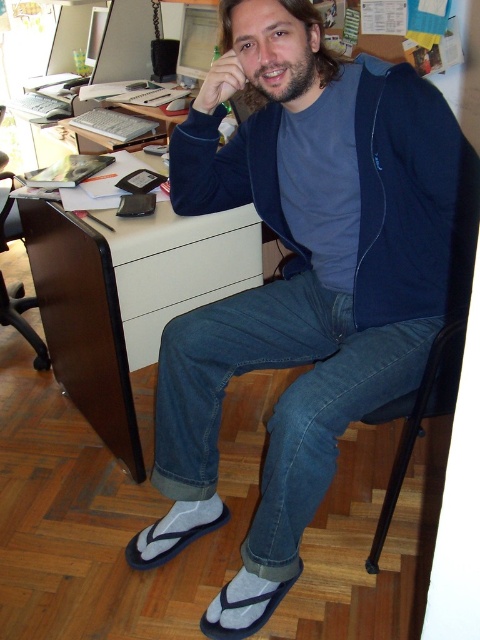
You are organizing a photo shoot and need to ensure that the blue cotton shirt at upper center is placed to the left of the brown wood desk at center. Based on the scene, is this currently the case?

The blue cotton shirt at upper center is positioned on the right side of the brown wood desk at center, so it is not currently placed to the left as required.

You are standing in front of the desk in the home office scene. You want to place a 1.2 meter long ruler on the desk without it overlapping any existing items. Considering the blue cotton shirt at upper center is positioned near the edge of the desk, will the ruler fit horizontally on the desk?

The blue cotton shirt at upper center is 1.16 meters away from the viewer. Since the ruler is 1.2 meters long and the shirt is near the edge, there might not be enough space for the ruler to fit horizontally without overlapping items unless the desk is significantly wider than the ruler. However, the exact desk dimensions aren

Consider the image. You are organizing your home office and want to place a new plant between the blue fleece sweatshirt at center and the brown wood desk at center. Based on their positions, which object should the plant be closer to?

The plant should be placed closer to the brown wood desk at center because the blue fleece sweatshirt at center is positioned to the right of the brown wood desk at center.